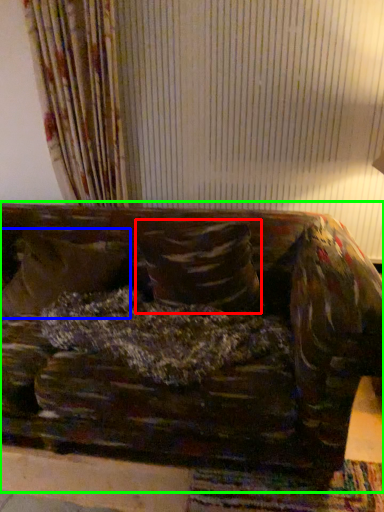
Question: Based on their relative distances, which object is farther from pillow (highlighted by a red box)? Choose from pillow (highlighted by a blue box) and studio couch (highlighted by a green box).

Choices:
 (A) pillow
 (B) studio couch

Answer: (A)